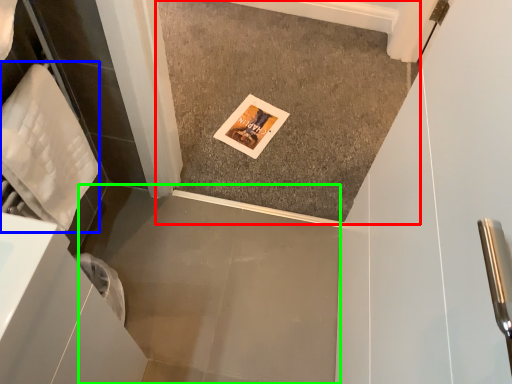
Question: Which object is the closest to the concrete (highlighted by a red box)? Choose among these: material (highlighted by a blue box) or concrete (highlighted by a green box).

Choices:
 (A) material
 (B) concrete

Answer: (B)